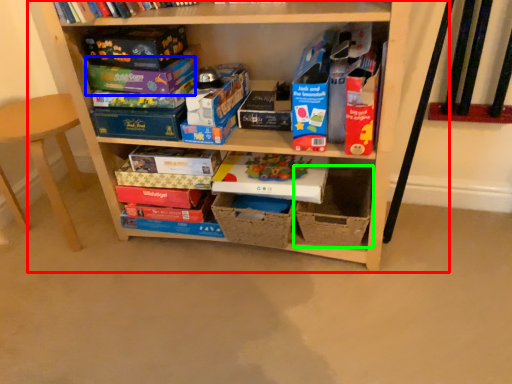
Question: Estimate the real-world distances between objects in this image. Which object is farther from shelf (highlighted by a red box), paperback book (highlighted by a blue box) or cardboard box (highlighted by a green box)?

Choices:
 (A) paperback book
 (B) cardboard box

Answer: (A)